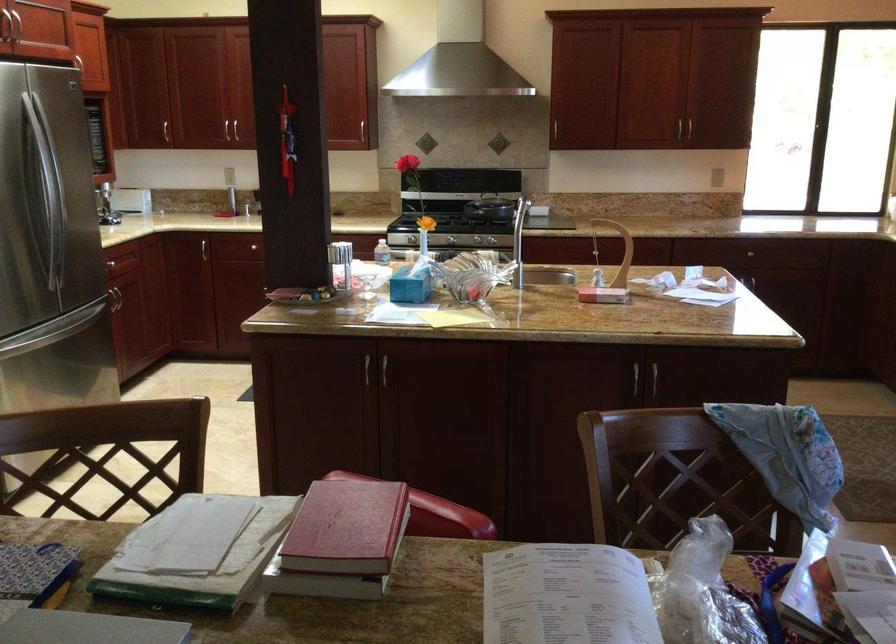
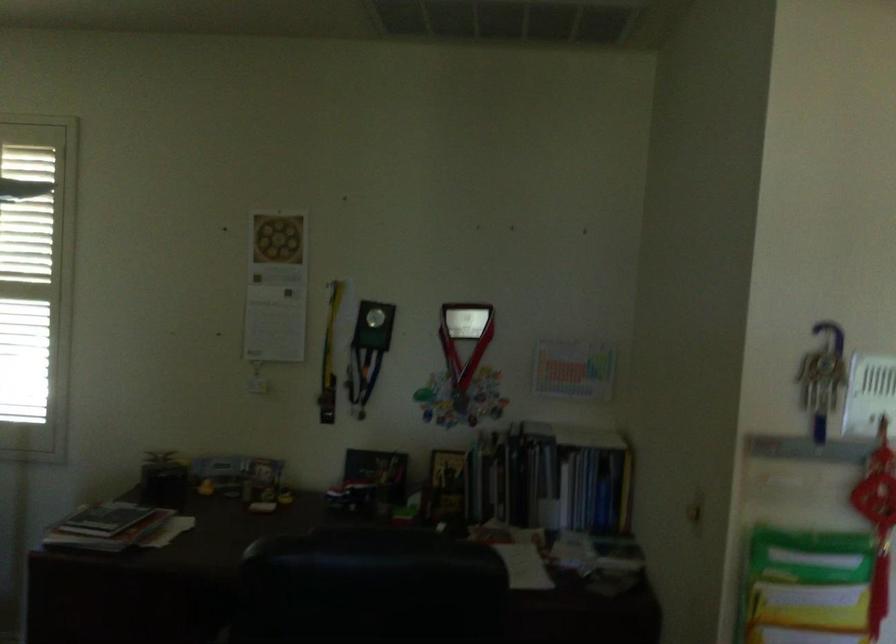
Question: The camera is either moving clockwise (left) or counter-clockwise (right) around the object. The first image is from the beginning of the video and the second image is from the end. Is the camera moving left or right when shooting the video?

Choices:
 (A) Left
 (B) Right

Answer: (B)